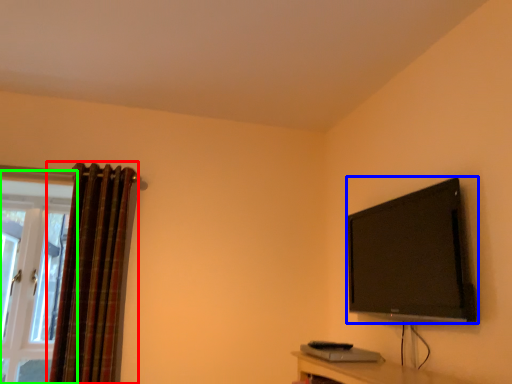
Question: Which object is the farthest from curtain (highlighted by a red box)? Choose among these: television (highlighted by a blue box) or window (highlighted by a green box).

Choices:
 (A) television
 (B) window

Answer: (A)